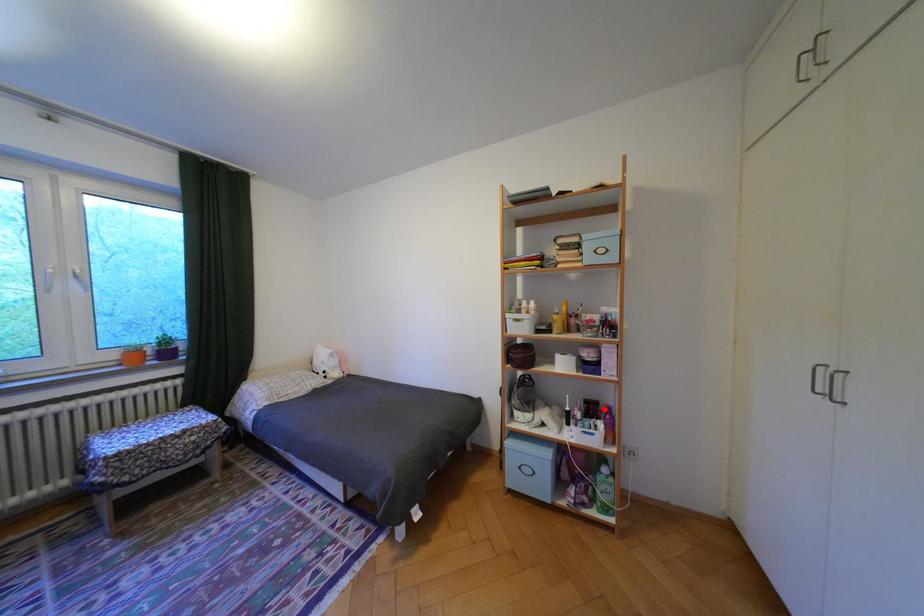
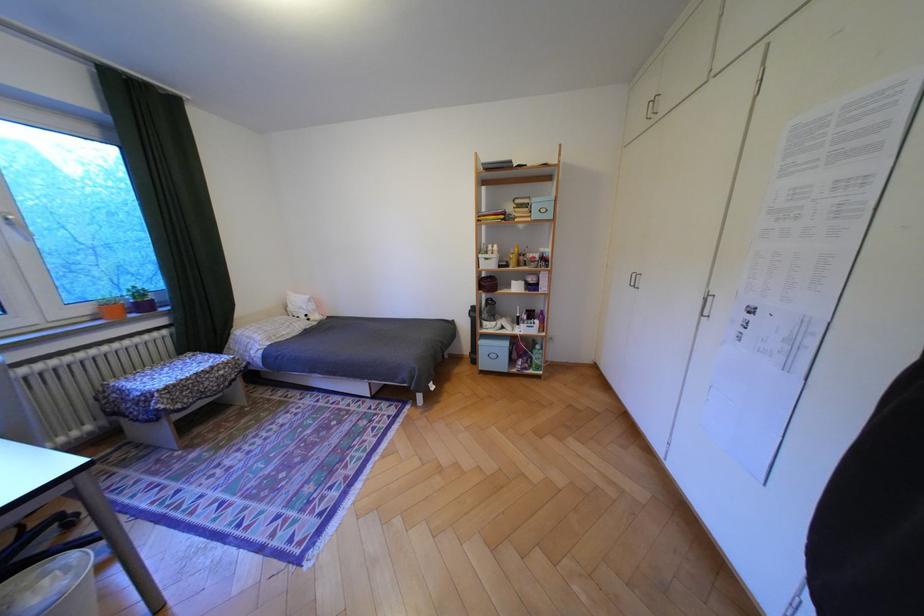
The point at the highlighted location is marked in the first image. Where is the corresponding point in the second image?

(542, 315)